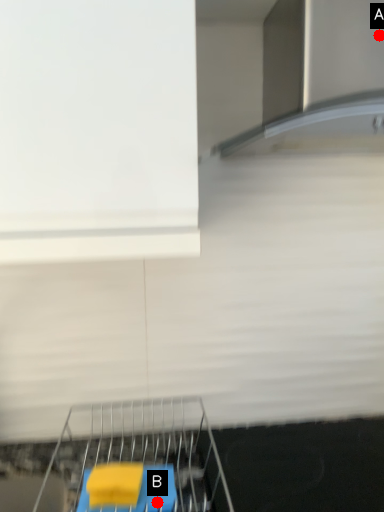
Question: Two points are circled on the image, labeled by A and B beside each circle. Which point is farther to the camera?

Choices:
 (A) A is further
 (B) B is further

Answer: (B)